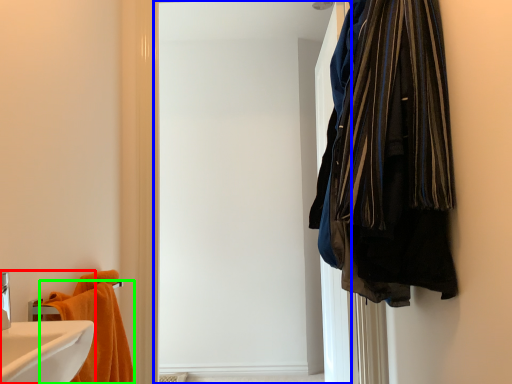
Question: Which object is positioned farthest from bathroom cabinet (highlighted by a red box)? Select from screen door (highlighted by a blue box) and towel (highlighted by a green box).

Choices:
 (A) screen door
 (B) towel

Answer: (A)